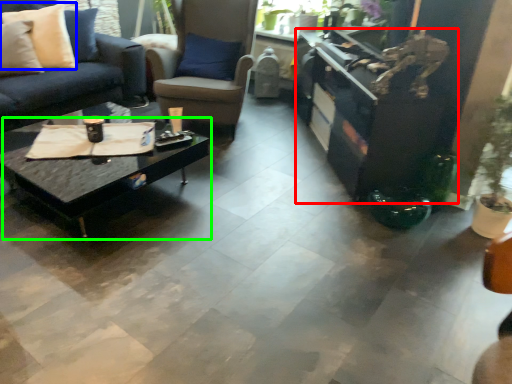
Question: Based on their relative distances, which object is farther from entertainment center (highlighted by a red box)? Choose from pillow (highlighted by a blue box) and coffee table (highlighted by a green box).

Choices:
 (A) pillow
 (B) coffee table

Answer: (A)